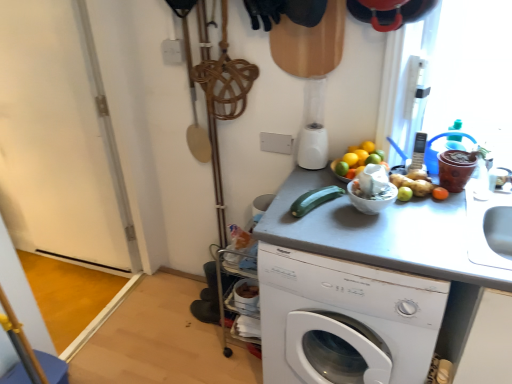
This screenshot has width=512, height=384. Find the location of `white glossy bowl at upper right`. white glossy bowl at upper right is located at coordinates (371, 198).

The width and height of the screenshot is (512, 384). Find the location of `silver metallic phone at upper right`. silver metallic phone at upper right is located at coordinates (418, 152).

Identify the location of gray matte counter top at center. This screenshot has width=512, height=384. (379, 233).

This screenshot has height=384, width=512. Describe the element at coordinates (379, 233) in the screenshot. I see `gray matte counter top at center` at that location.

Describe the element at coordinates (314, 200) in the screenshot. I see `green matte cucumber at center` at that location.

Find the location of `orange matte at upper right`. orange matte at upper right is located at coordinates (350, 159).

Where is `white glossy bowl at upper right`? The image size is (512, 384). white glossy bowl at upper right is located at coordinates (371, 198).

Considering the sizes of silver metallic phone at upper right and gray matte counter top at center in the image, is silver metallic phone at upper right taller or shorter than gray matte counter top at center?

silver metallic phone at upper right is shorter than gray matte counter top at center.

From a real-world perspective, is silver metallic phone at upper right above or below gray matte counter top at center?

In terms of real-world spatial position, silver metallic phone at upper right is above gray matte counter top at center.

Which of these two, silver metallic phone at upper right or gray matte counter top at center, is thinner?

With smaller width is silver metallic phone at upper right.

From the image's perspective, which is above, silver metallic phone at upper right or gray matte counter top at center?

From the image's view, silver metallic phone at upper right is above.

Is the position of white glossy bowl at upper right more distant than that of silver metallic phone at upper right?

No, white glossy bowl at upper right is closer to the camera.

Considering the sizes of objects white glossy bowl at upper right and silver metallic phone at upper right in the image provided, who is shorter, white glossy bowl at upper right or silver metallic phone at upper right?

Standing shorter between the two is white glossy bowl at upper right.

Does white glossy bowl at upper right have a smaller size compared to silver metallic phone at upper right?

No.

Which object is thinner, white glossy bowl at upper right or silver metallic phone at upper right?

Thinner between the two is silver metallic phone at upper right.

Can you confirm if orange matte at upper right is taller than green matte cucumber at center?

No.

Is orange matte at upper right facing away from green matte cucumber at center?

orange matte at upper right is not turned away from green matte cucumber at center.

Is orange matte at upper right spatially inside green matte cucumber at center, or outside of it?

orange matte at upper right cannot be found inside green matte cucumber at center.

Between silver metallic phone at upper right and white glossy bowl at upper right, which one appears on the left side from the viewer's perspective?

Positioned to the left is white glossy bowl at upper right.

Is silver metallic phone at upper right wider or thinner than white glossy bowl at upper right?

Considering their sizes, silver metallic phone at upper right looks slimmer than white glossy bowl at upper right.

From the image's perspective, who appears lower, silver metallic phone at upper right or white glossy bowl at upper right?

white glossy bowl at upper right, from the image's perspective.

Between white glossy bowl at upper right and green matte cucumber at center, which one is positioned in front?

Positioned in front is white glossy bowl at upper right.

Measure the distance from white glossy bowl at upper right to green matte cucumber at center.

The distance of white glossy bowl at upper right from green matte cucumber at center is 5.61 inches.

Can you confirm if white glossy bowl at upper right is wider than green matte cucumber at center?

No.

Considering the relative sizes of white glossy bowl at upper right and green matte cucumber at center in the image provided, is white glossy bowl at upper right bigger than green matte cucumber at center?

Indeed, white glossy bowl at upper right has a larger size compared to green matte cucumber at center.

Looking at this image, which of these two, gray matte counter top at center or white glossy bowl at upper right, is wider?

gray matte counter top at center.

Is gray matte counter top at center in contact with white glossy bowl at upper right?

No.

Is gray matte counter top at center surrounding white glossy bowl at upper right?

Definitely not — white glossy bowl at upper right is not inside gray matte counter top at center.

In order to click on counter top in front of the white glossy bowl at upper right in this screenshot , I will do `click(379, 233)`.

Identify the location of appliance on the right of white plastic washing machine at center. The width and height of the screenshot is (512, 384). (418, 152).

From the image's perspective, relative to silver metallic phone at upper right, is white plastic washing machine at center above or below?

Based on their image positions, white plastic washing machine at center is located beneath silver metallic phone at upper right.

From a real-world perspective, is white plastic washing machine at center positioned above or below silver metallic phone at upper right?

white plastic washing machine at center is below silver metallic phone at upper right.

Considering the relative sizes of white plastic washing machine at center and silver metallic phone at upper right in the image provided, is white plastic washing machine at center wider than silver metallic phone at upper right?

Yes, white plastic washing machine at center is wider than silver metallic phone at upper right.

Where is `counter top on the left side of silver metallic phone at upper right`? The height and width of the screenshot is (384, 512). counter top on the left side of silver metallic phone at upper right is located at coordinates pos(379,233).

Locate an element on the screen. This screenshot has height=384, width=512. appliance behind the white glossy bowl at upper right is located at coordinates (418, 152).

Which object lies further to the anchor point white plastic washing machine at center, white glossy bowl at upper right or gray matte counter top at center?

white glossy bowl at upper right lies further to white plastic washing machine at center than the other object.

When comparing their distances from green matte cucumber at center, does silver metallic phone at upper right or gray matte counter top at center seem further?

silver metallic phone at upper right is further to green matte cucumber at center.

Based on the photo, looking at the image, which one is located further to white plastic washing machine at center, green matte cucumber at center or orange matte at upper right?

Result: Among the two, orange matte at upper right is located further to white plastic washing machine at center.

Which object lies further to the anchor point gray matte counter top at center, white plastic washing machine at center or green matte cucumber at center?

white plastic washing machine at center lies further to gray matte counter top at center than the other object.

Which object lies further to the anchor point white glossy bowl at upper right, green matte cucumber at center or gray matte counter top at center?

Based on the image, gray matte counter top at center appears to be further to white glossy bowl at upper right.

Looking at the image, which one is located further to silver metallic phone at upper right, gray matte counter top at center or white glossy bowl at upper right?

Among the two, gray matte counter top at center is located further to silver metallic phone at upper right.

From the image, which object appears to be farther from white plastic washing machine at center, silver metallic phone at upper right or orange matte at upper right?

The object further to white plastic washing machine at center is silver metallic phone at upper right.

Considering their positions, is silver metallic phone at upper right positioned closer to white glossy bowl at upper right than orange matte at upper right?

orange matte at upper right is closer to white glossy bowl at upper right.

This screenshot has width=512, height=384. I want to click on washing machine between orange matte at upper right and gray matte counter top at center in the vertical direction, so click(x=344, y=320).

I want to click on cucumber that lies between orange matte at upper right and white plastic washing machine at center from top to bottom, so click(314, 200).

Where is `basin between green matte cucumber at center and silver metallic phone at upper right from left to right`? The image size is (512, 384). basin between green matte cucumber at center and silver metallic phone at upper right from left to right is located at coordinates (371, 198).

This screenshot has height=384, width=512. Find the location of `cucumber between orange matte at upper right and gray matte counter top at center in the up-down direction`. cucumber between orange matte at upper right and gray matte counter top at center in the up-down direction is located at coordinates (314, 200).